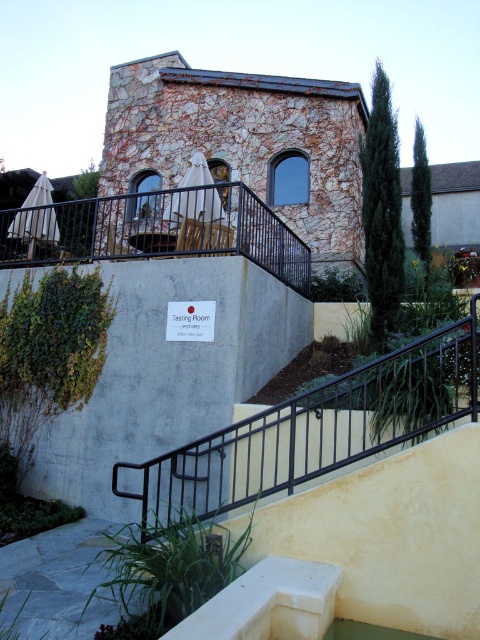
Is black metal/rail at lower center closer to the viewer compared to black metal railing at upper center?

Yes, it is in front of black metal railing at upper center.

Consider the image. Does black metal/rail at lower center have a greater height compared to black metal railing at upper center?

Yes, black metal/rail at lower center is taller than black metal railing at upper center.

Identify the location of black metal/rail at lower center. The image size is (480, 640). (313, 429).